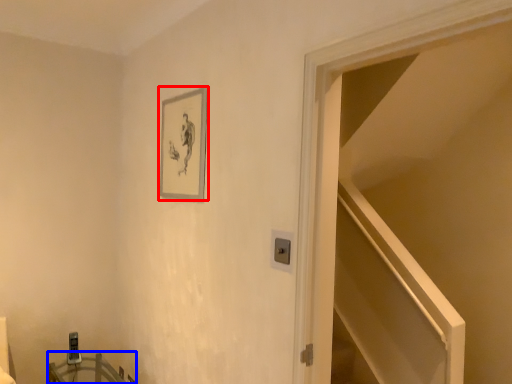
Question: Which object is further to the camera taking this photo, picture frame (highlighted by a red box) or table (highlighted by a blue box)?

Choices:
 (A) picture frame
 (B) table

Answer: (B)